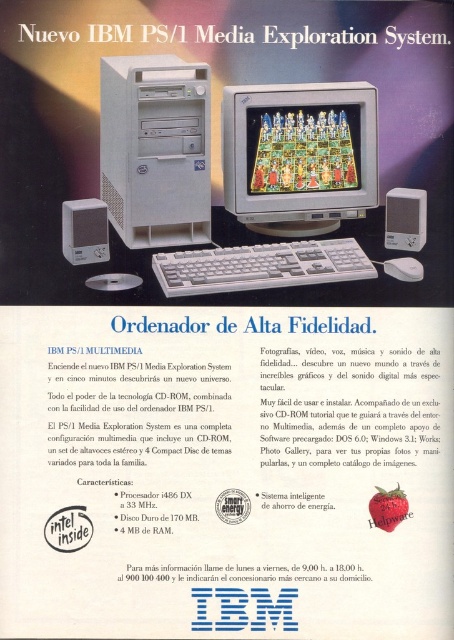
Question: Is matte plastic monitor at center in front of white plastic keyboard at center?

Choices:
 (A) yes
 (B) no

Answer: (B)

Question: Is white plastic computer tower at center-left thinner than white plastic keyboard at center?

Choices:
 (A) no
 (B) yes

Answer: (B)

Question: Is white plastic computer tower at center-left to the right of white plastic keyboard at center from the viewer's perspective?

Choices:
 (A) yes
 (B) no

Answer: (B)

Question: Which is farther from the white plastic mouse at lower right?

Choices:
 (A) matte plastic monitor at center
 (B) white plastic keyboard at center
 (C) white plastic computer tower at center-left

Answer: (C)

Question: Among these points, which one is farthest from the camera?

Choices:
 (A) (187, 124)
 (B) (415, 276)
 (C) (176, 282)
 (D) (370, 140)

Answer: (D)

Question: Among these objects, which one is nearest to the camera?

Choices:
 (A) matte plastic monitor at center
 (B) white plastic keyboard at center
 (C) white plastic mouse at lower right
 (D) white plastic computer tower at center-left

Answer: (B)